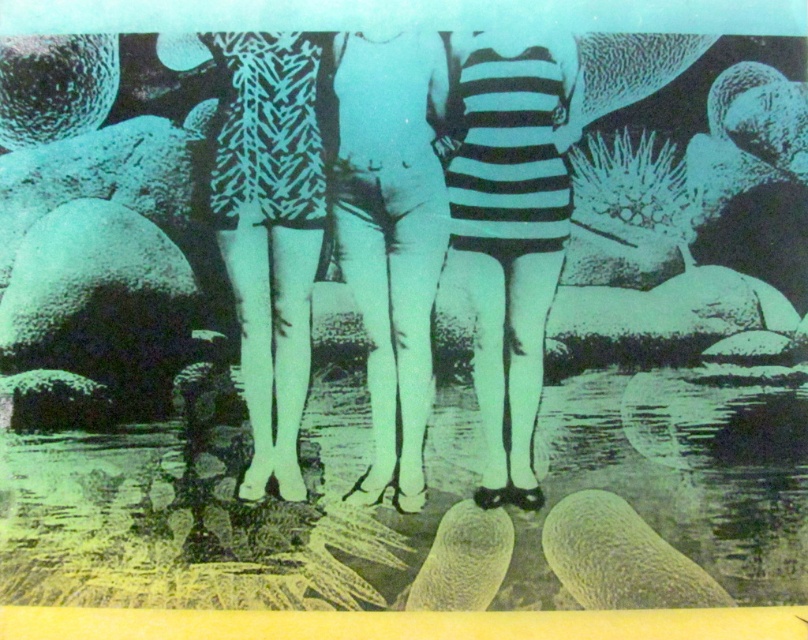
Can you confirm if striped fabric dress at center is bigger than white matte swimsuit at center?

Yes.

Between striped fabric dress at center and white matte swimsuit at center, which one appears on the left side from the viewer's perspective?

From the viewer's perspective, white matte swimsuit at center appears more on the left side.

Describe the element at coordinates (508, 234) in the screenshot. Image resolution: width=808 pixels, height=640 pixels. I see `striped fabric dress at center` at that location.

At what (x,y) coordinates should I click in order to perform the action: click on striped fabric dress at center. Please return your answer as a coordinate pair (x, y). Looking at the image, I should click on (508, 234).